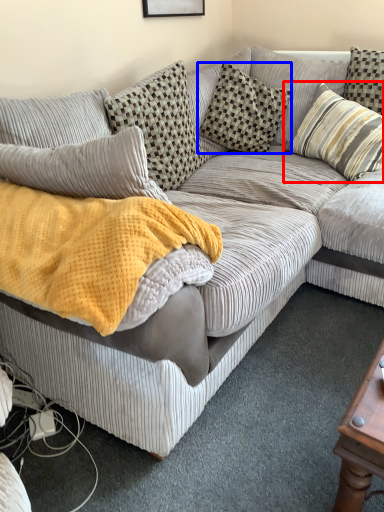
Question: Which object is further to the camera taking this photo, pillow (highlighted by a red box) or pillow (highlighted by a blue box)?

Choices:
 (A) pillow
 (B) pillow

Answer: (B)